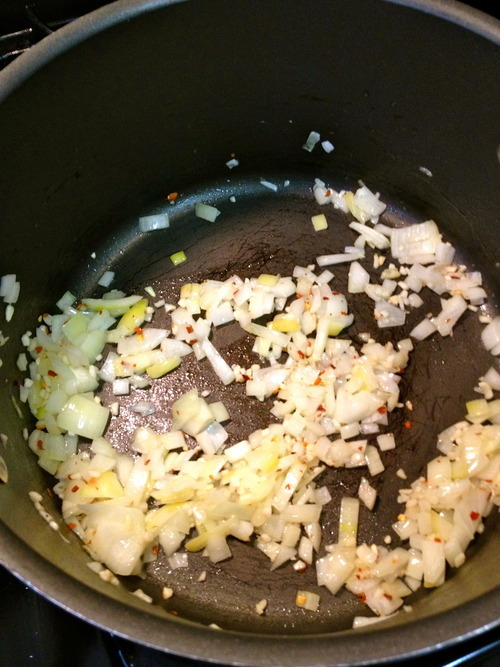
The image size is (500, 667). Identify the location of stove top behind frying pan. (60, 634).